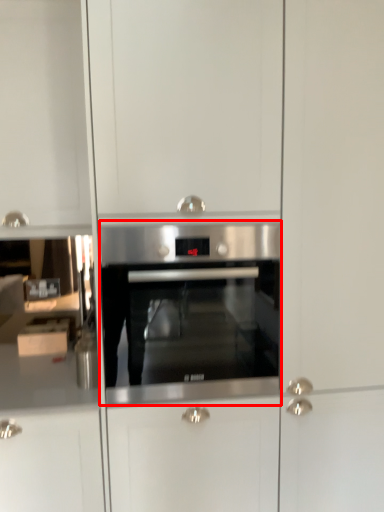
Question: From the image's perspective, what is the correct spatial positioning of oven (annotated by the red box) in reference to cabinetry?

Choices:
 (A) below
 (B) above

Answer: (B)